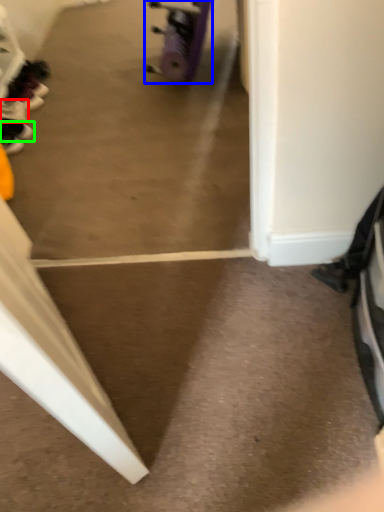
Question: Which object is the closest to the footwear (highlighted by a red box)? Choose among these: wheel (highlighted by a blue box) or footwear (highlighted by a green box).

Choices:
 (A) wheel
 (B) footwear

Answer: (B)